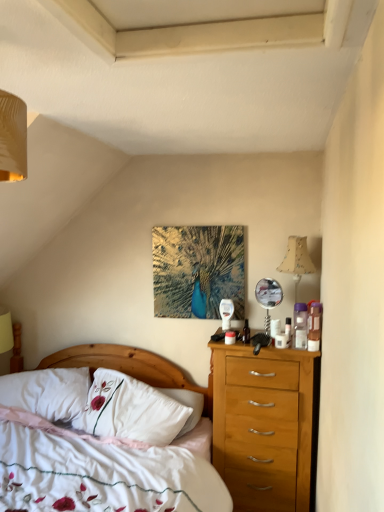
Question: Is white cotton bed at center wider than white embroidered pillow at center, acting as the second pillow starting from the left?

Choices:
 (A) no
 (B) yes

Answer: (B)

Question: Is white cotton bed at center shorter than white embroidered pillow at center, acting as the second pillow starting from the left?

Choices:
 (A) yes
 (B) no

Answer: (B)

Question: Could you tell me if white cotton bed at center is turned towards white embroidered pillow at center, acting as the second pillow starting from the left?

Choices:
 (A) no
 (B) yes

Answer: (A)

Question: Considering the relative sizes of white cotton bed at center and white embroidered pillow at center, the first pillow viewed from the right, in the image provided, is white cotton bed at center taller than white embroidered pillow at center, the first pillow viewed from the right,?

Choices:
 (A) no
 (B) yes

Answer: (B)

Question: Does white cotton bed at center have a smaller size compared to white embroidered pillow at center, the first pillow viewed from the right?

Choices:
 (A) yes
 (B) no

Answer: (B)

Question: Visually, is white soft pillow at lower left, the second pillow viewed from the right, positioned to the left or to the right of beige fabric lampshade at right?

Choices:
 (A) left
 (B) right

Answer: (A)

Question: From their relative heights in the image, would you say white soft pillow at lower left, the second pillow viewed from the right, is taller or shorter than beige fabric lampshade at right?

Choices:
 (A) short
 (B) tall

Answer: (A)

Question: Does point (11, 389) appear closer or farther from the camera than point (297, 274)?

Choices:
 (A) closer
 (B) farther

Answer: (B)

Question: Looking at the image, does white soft pillow at lower left, the second pillow viewed from the right, seem bigger or smaller compared to beige fabric lampshade at right?

Choices:
 (A) small
 (B) big

Answer: (B)

Question: From a real-world perspective, is metallic peacock art at center physically located above or below white cotton bed at center?

Choices:
 (A) below
 (B) above

Answer: (B)

Question: Is metallic peacock art at center situated inside white cotton bed at center or outside?

Choices:
 (A) outside
 (B) inside

Answer: (A)

Question: Based on their positions, is metallic peacock art at center located to the left or right of white cotton bed at center?

Choices:
 (A) right
 (B) left

Answer: (A)

Question: Is point (225, 238) positioned closer to the camera than point (140, 450)?

Choices:
 (A) closer
 (B) farther

Answer: (B)

Question: From a real-world perspective, relative to white embroidered pillow at center, acting as the second pillow starting from the left, is white cotton bed at center vertically above or below?

Choices:
 (A) below
 (B) above

Answer: (A)

Question: Considering the positions of white cotton bed at center and white embroidered pillow at center, acting as the second pillow starting from the left, in the image, is white cotton bed at center wider or thinner than white embroidered pillow at center, acting as the second pillow starting from the left,?

Choices:
 (A) wide
 (B) thin

Answer: (A)